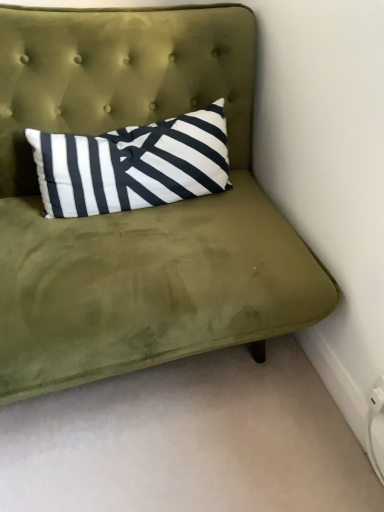
Question: Should I look upward or downward to see white plastic electric outlet at lower right?

Choices:
 (A) up
 (B) down

Answer: (B)

Question: Can you confirm if olive green velvet couch at upper center is positioned to the left of white plastic electric outlet at lower right?

Choices:
 (A) yes
 (B) no

Answer: (A)

Question: Is olive green velvet couch at upper center oriented away from white plastic electric outlet at lower right?

Choices:
 (A) yes
 (B) no

Answer: (B)

Question: From the image's perspective, is olive green velvet couch at upper center on white plastic electric outlet at lower right?

Choices:
 (A) yes
 (B) no

Answer: (A)

Question: Is olive green velvet couch at upper center in contact with white plastic electric outlet at lower right?

Choices:
 (A) no
 (B) yes

Answer: (A)

Question: From a real-world perspective, is olive green velvet couch at upper center positioned over white plastic electric outlet at lower right based on gravity?

Choices:
 (A) yes
 (B) no

Answer: (A)

Question: Are olive green velvet couch at upper center and white plastic electric outlet at lower right located far from each other?

Choices:
 (A) yes
 (B) no

Answer: (B)

Question: Is the surface of velvet green headboard at upper center in direct contact with white plastic electric outlet at lower right?

Choices:
 (A) yes
 (B) no

Answer: (B)

Question: From a real-world perspective, is velvet green headboard at upper center below white plastic electric outlet at lower right?

Choices:
 (A) yes
 (B) no

Answer: (B)

Question: Could you tell me if velvet green headboard at upper center is turned towards white plastic electric outlet at lower right?

Choices:
 (A) no
 (B) yes

Answer: (B)

Question: From the image's perspective, is velvet green headboard at upper center under white plastic electric outlet at lower right?

Choices:
 (A) yes
 (B) no

Answer: (B)

Question: Can you confirm if velvet green headboard at upper center is taller than white plastic electric outlet at lower right?

Choices:
 (A) yes
 (B) no

Answer: (A)

Question: Is velvet green headboard at upper center closer to camera compared to white plastic electric outlet at lower right?

Choices:
 (A) yes
 (B) no

Answer: (A)

Question: From a real-world perspective, does velvet green headboard at upper center sit lower than olive green velvet couch at upper center?

Choices:
 (A) yes
 (B) no

Answer: (B)